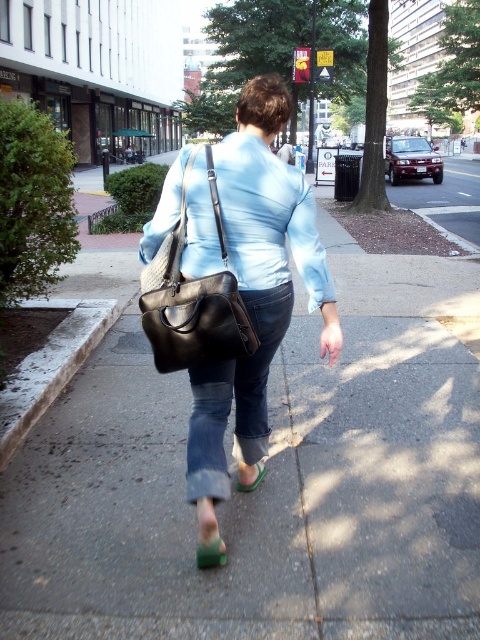
Question: Is green rubber sandal at lower center closer to the viewer compared to green suede sandal at lower center?

Choices:
 (A) yes
 (B) no

Answer: (A)

Question: Is black leather shoulder bag at center to the right of green suede sandal at lower center from the viewer's perspective?

Choices:
 (A) no
 (B) yes

Answer: (A)

Question: Which point is farther to the camera?

Choices:
 (A) (261, 268)
 (B) (252, 483)

Answer: (B)

Question: Which point is closer to the camera taking this photo?

Choices:
 (A) (252, 340)
 (B) (192, 284)
 (C) (261, 465)

Answer: (B)

Question: Is green rubber sandal at lower center to the right of green suede sandal at lower center from the viewer's perspective?

Choices:
 (A) yes
 (B) no

Answer: (B)

Question: Estimate the real-world distances between objects in this image. Which object is closer to the matte black bag at center?

Choices:
 (A) green suede sandal at lower center
 (B) black leather shoulder bag at center
 (C) green rubber sandal at lower center

Answer: (B)